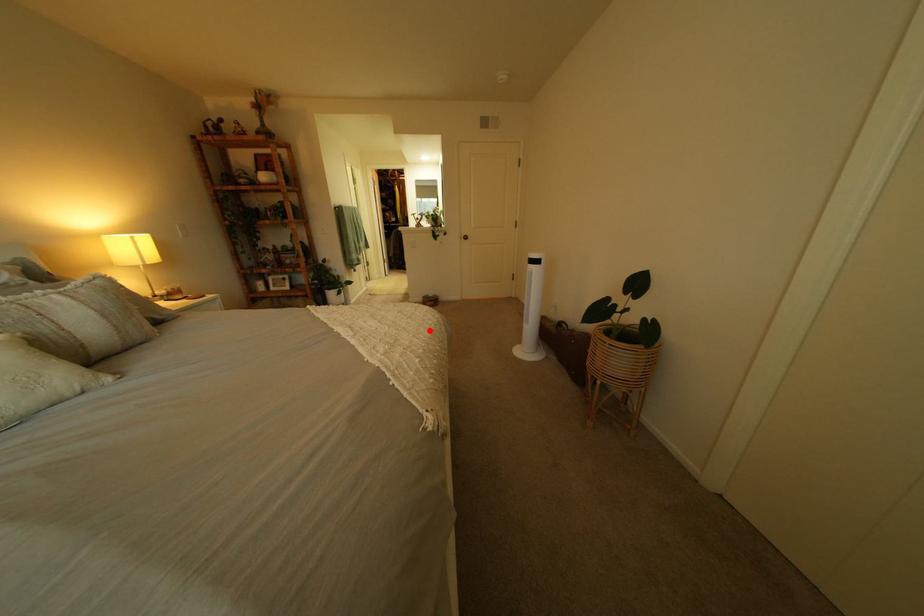
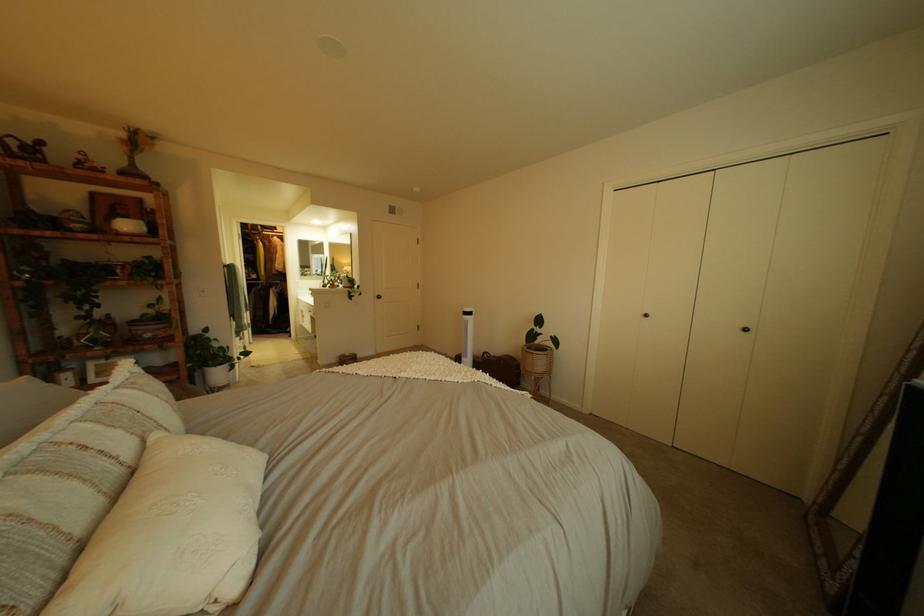
Where in the second image is the point corresponding to the highlighted location from the first image?

(468, 365)